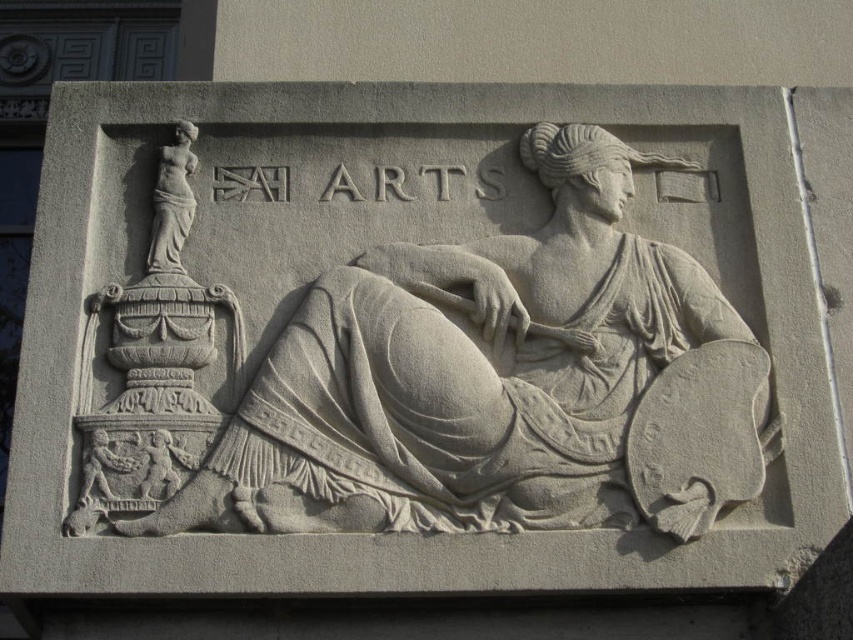
Question: Does white stone sculpture at center lie in front of smooth white statue at upper left?

Choices:
 (A) no
 (B) yes

Answer: (B)

Question: Which of the following is the closest to the observer?

Choices:
 (A) white stone sculpture at center
 (B) smooth white statue at upper left

Answer: (A)

Question: Can you confirm if white stone sculpture at center is positioned above smooth white statue at upper left?

Choices:
 (A) no
 (B) yes

Answer: (A)

Question: From the image, what is the correct spatial relationship of white stone sculpture at center in relation to smooth white statue at upper left?

Choices:
 (A) below
 (B) above

Answer: (A)

Question: Which object is closer to the camera taking this photo?

Choices:
 (A) white stone sculpture at center
 (B) smooth white statue at upper left

Answer: (A)

Question: Which of the following is the farthest from the observer?

Choices:
 (A) (171, 225)
 (B) (573, 298)

Answer: (A)